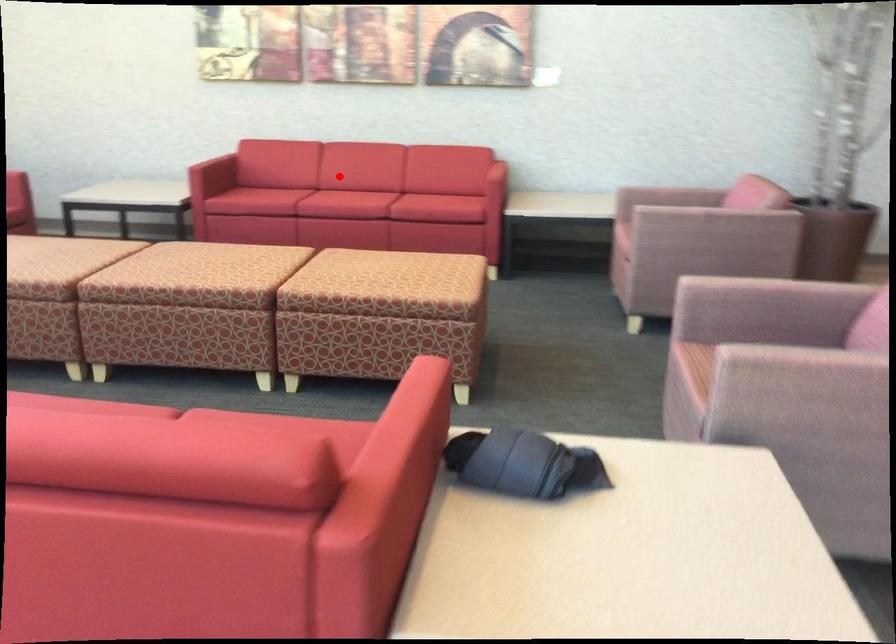
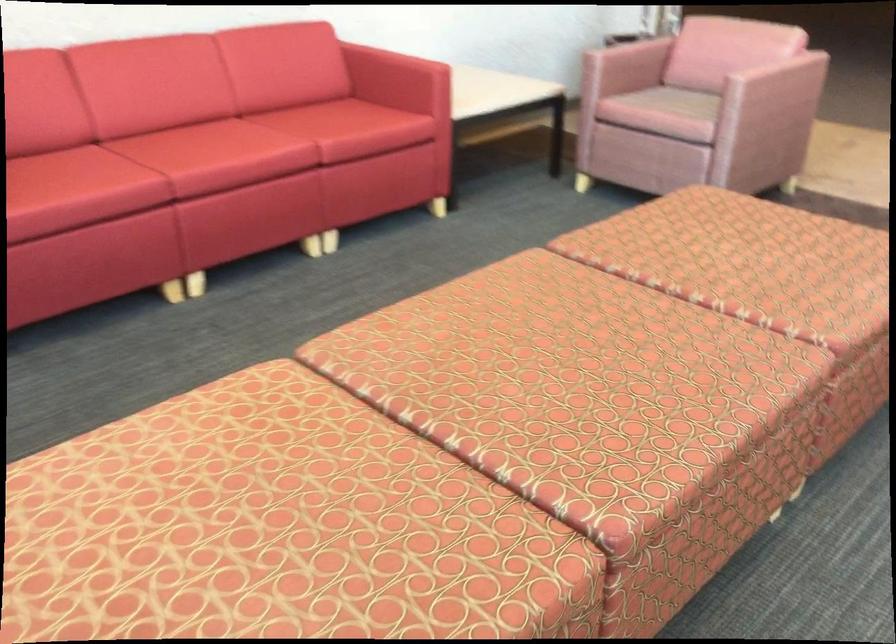
Question: I am providing you with two images of the same scene from different viewpoints. Image1 has a red point marked. In image2, the corresponding 3D location appears at what relative position? Reply with the corresponding letter.

Choices:
 (A) Closer
 (B) Farther

Answer: (A)